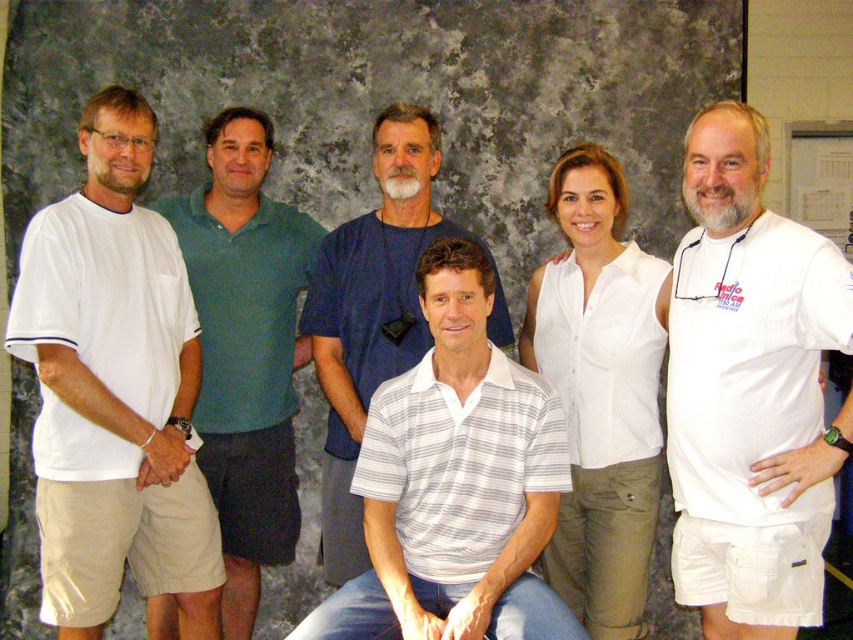
Is white cotton t-shirt at center shorter than green polo shirt at center?

Indeed, white cotton t-shirt at center has a lesser height compared to green polo shirt at center.

Is white cotton t-shirt at center above green polo shirt at center?

Yes.

Which is behind, point (757, 467) or point (230, 230)?

The point (230, 230) is behind.

Locate an element on the screen. white cotton t-shirt at center is located at coordinates (747, 380).

Based on the photo, is white button-up shirt at center to the left of white striped polo shirt at center from the viewer's perspective?

Incorrect, white button-up shirt at center is not on the left side of white striped polo shirt at center.

How distant is white button-up shirt at center from white striped polo shirt at center?

They are 15.36 inches apart.

Between point (578, 326) and point (422, 189), which one is positioned behind?

The point (422, 189) is behind.

The width and height of the screenshot is (853, 640). I want to click on white button-up shirt at center, so click(x=601, y=392).

Does white cotton t-shirt at center have a lesser width compared to white striped polo shirt at center?

Yes.

Is white cotton t-shirt at center positioned in front of white striped polo shirt at center?

Yes, white cotton t-shirt at center is in front of white striped polo shirt at center.

Is point (741, 385) in front of point (378, 364)?

Yes, point (741, 385) is in front of point (378, 364).

Locate an element on the screen. The height and width of the screenshot is (640, 853). white cotton t-shirt at center is located at coordinates (747, 380).